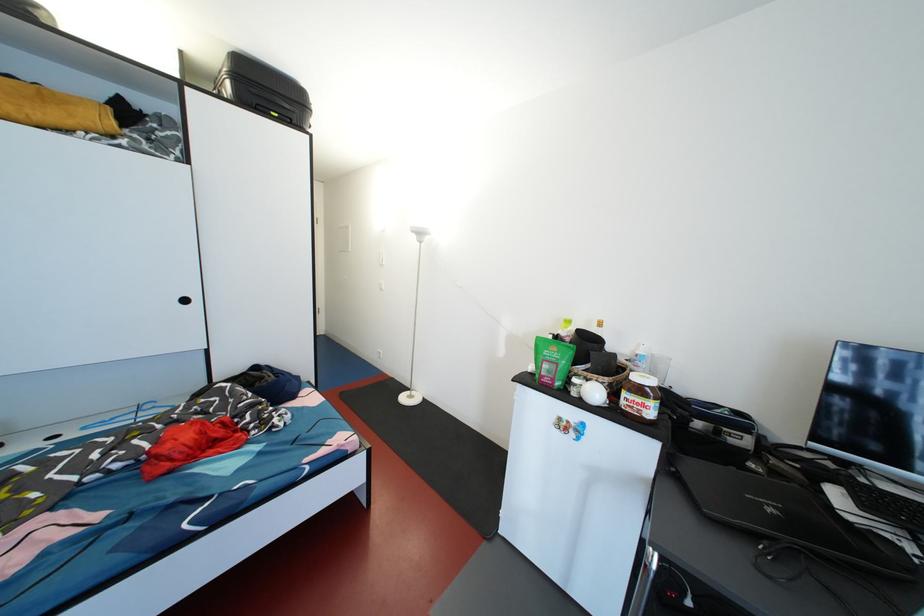
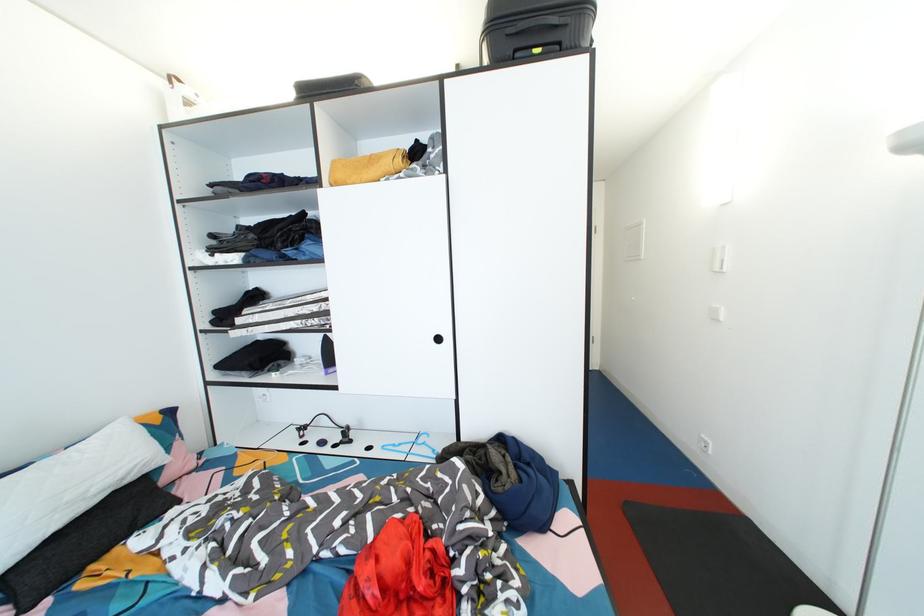
Locate, in the second image, the point that corresponds to point 235,89 in the first image.

(492, 51)